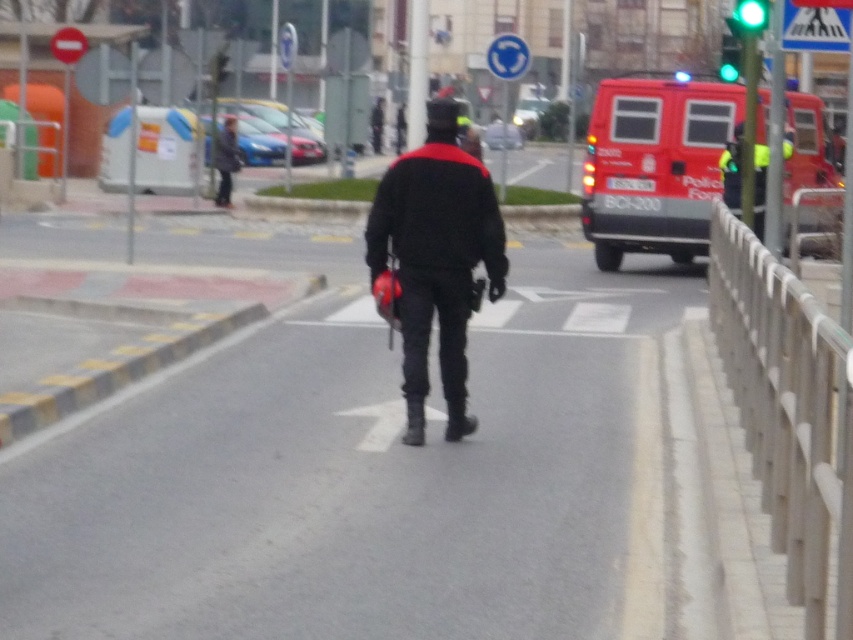
Question: Can you confirm if reflective yellow vest at right is positioned to the left of black matte helmet at center?

Choices:
 (A) yes
 (B) no

Answer: (B)

Question: Based on their relative distances, which object is nearer to the red matte van at right?

Choices:
 (A) matte black helmet at center
 (B) black matte helmet at upper center
 (C) green glass traffic light at upper right
 (D) black matte helmet at center

Answer: (C)

Question: Which point is closer to the camera?

Choices:
 (A) reflective yellow vest at right
 (B) matte black helmet at center

Answer: (B)

Question: Can you confirm if matte black helmet at center is wider than reflective yellow vest at right?

Choices:
 (A) yes
 (B) no

Answer: (B)

Question: Can you confirm if matte black helmet at center is smaller than black matte helmet at center?

Choices:
 (A) yes
 (B) no

Answer: (A)

Question: Among these objects, which one is farthest from the camera?

Choices:
 (A) red matte van at right
 (B) black matte helmet at upper center

Answer: (B)